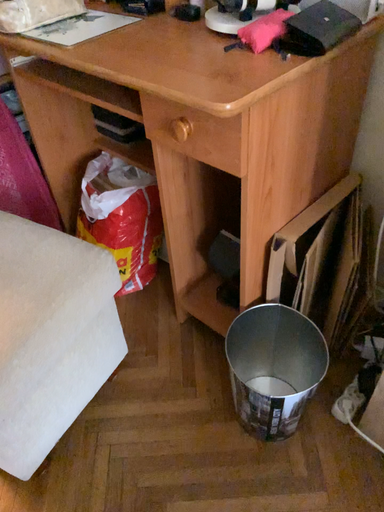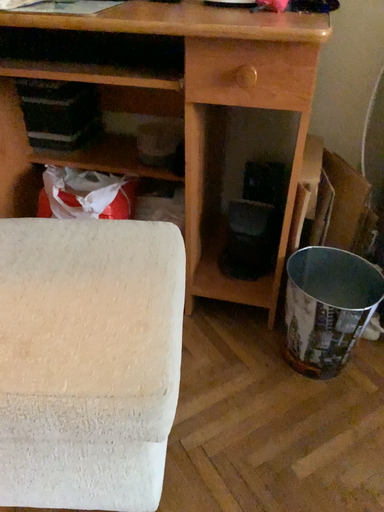
Question: How did the camera likely rotate when shooting the video?

Choices:
 (A) rotated upward
 (B) rotated downward

Answer: (A)